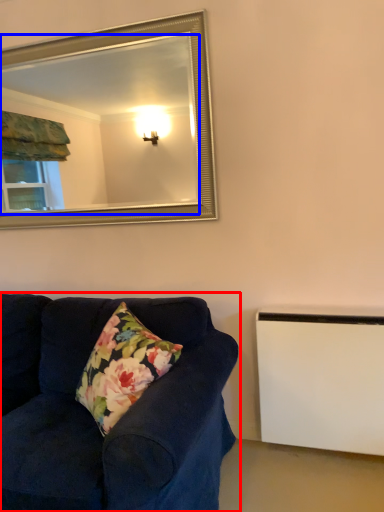
Question: Which object is further to the camera taking this photo, studio couch (highlighted by a red box) or mirror (highlighted by a blue box)?

Choices:
 (A) studio couch
 (B) mirror

Answer: (B)